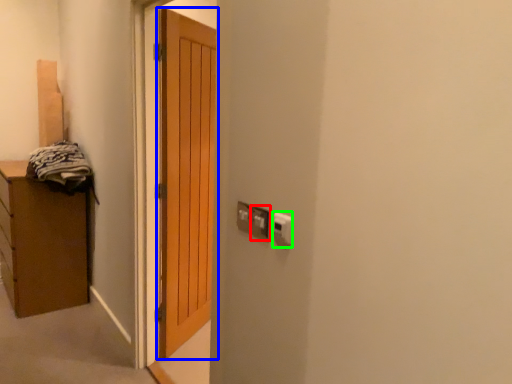
Question: Based on their relative distances, which object is farther from electric outlet (highlighted by a red box)? Choose from door (highlighted by a blue box) and electric outlet (highlighted by a green box).

Choices:
 (A) door
 (B) electric outlet

Answer: (A)